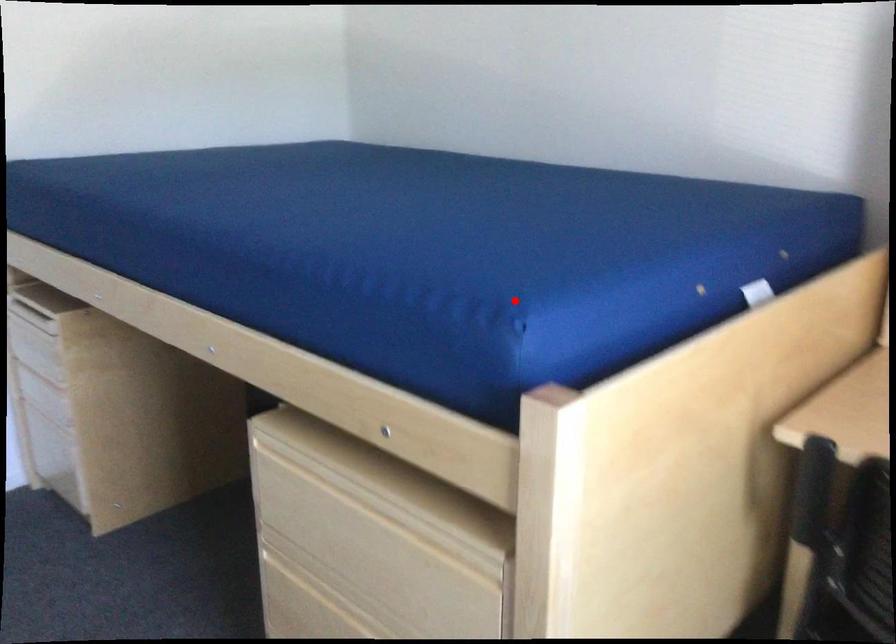
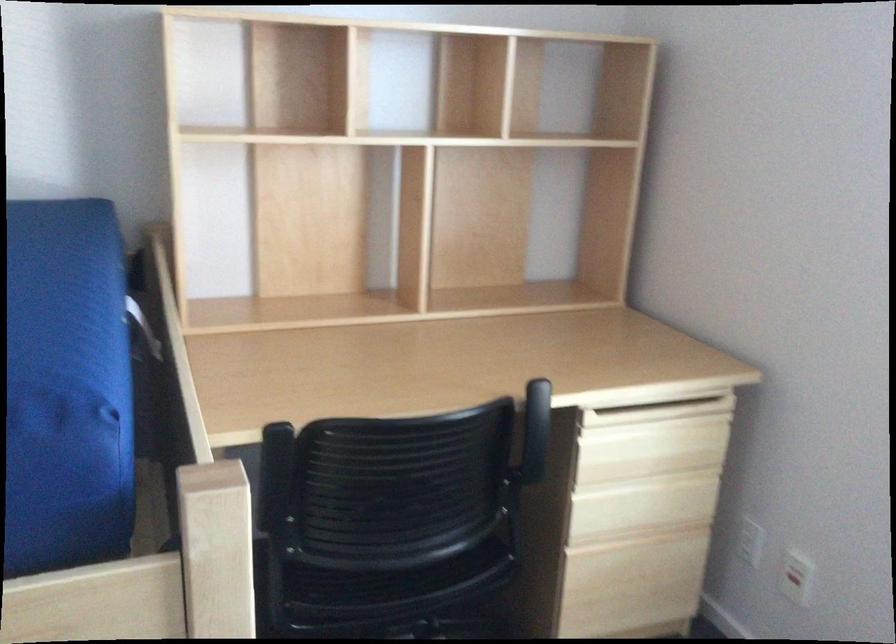
Locate, in the second image, the point that corresponds to the highlighted location in the first image.

(66, 388)